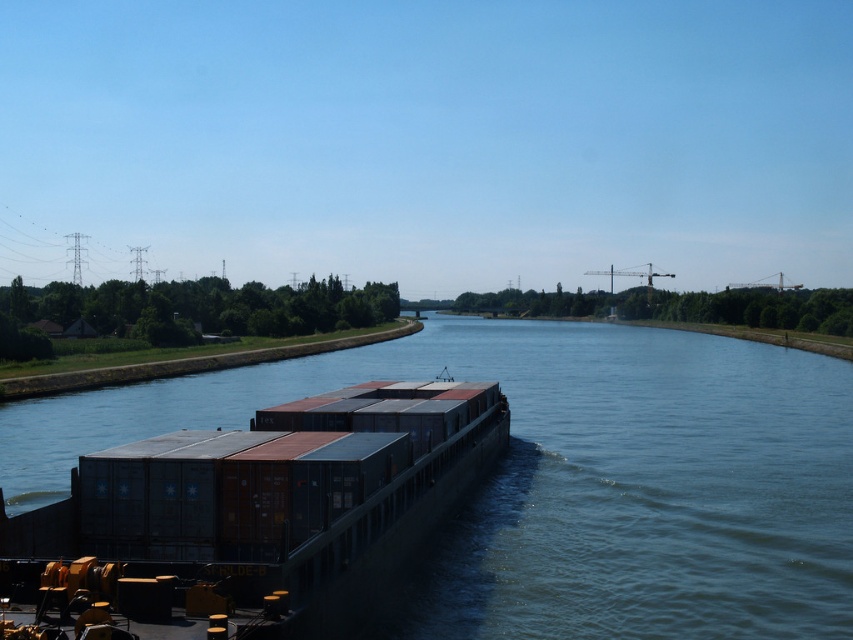
You are a delivery worker planning to cross the canal using a small boat. The boat can only carry items that are narrower than the canal. Given that the boat is as wide as the metallic gray containers at center, can you safely navigate the blue water at center with your boat?

The blue water at center is wider than the metallic gray containers at center. Since the boat is as wide as the containers, it can safely navigate the blue water at center without any issues.